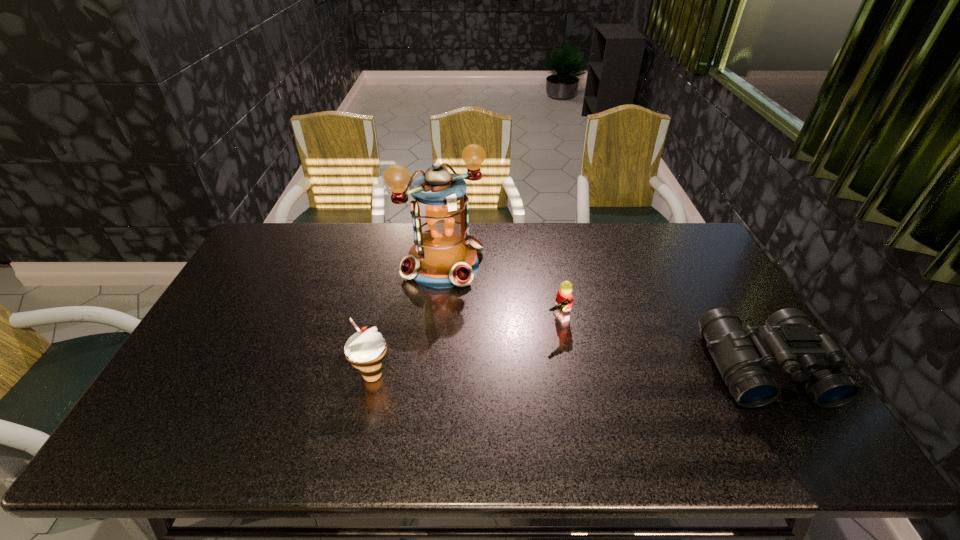
This screenshot has height=540, width=960. In order to click on vacant point located between the icecream and the farthest object in this screenshot , I will do (x=408, y=320).

I want to click on free spot between the rightmost object and the icecream, so click(x=568, y=372).

Locate an element on the screen. The height and width of the screenshot is (540, 960). free spot between the lantern and the rightmost object is located at coordinates (604, 316).

This screenshot has height=540, width=960. I want to click on free spot between the icecream and the binoculars, so click(x=568, y=372).

Where is `object that ranks as the third closest to the tallest object`? The image size is (960, 540). object that ranks as the third closest to the tallest object is located at coordinates (743, 358).

Identify which object is the third closest to the rightmost object. Please provide its 2D coordinates. Your answer should be formatted as a tuple, i.e. [(x, y)], where the tuple contains the x and y coordinates of a point satisfying the conditions above.

[(366, 349)]